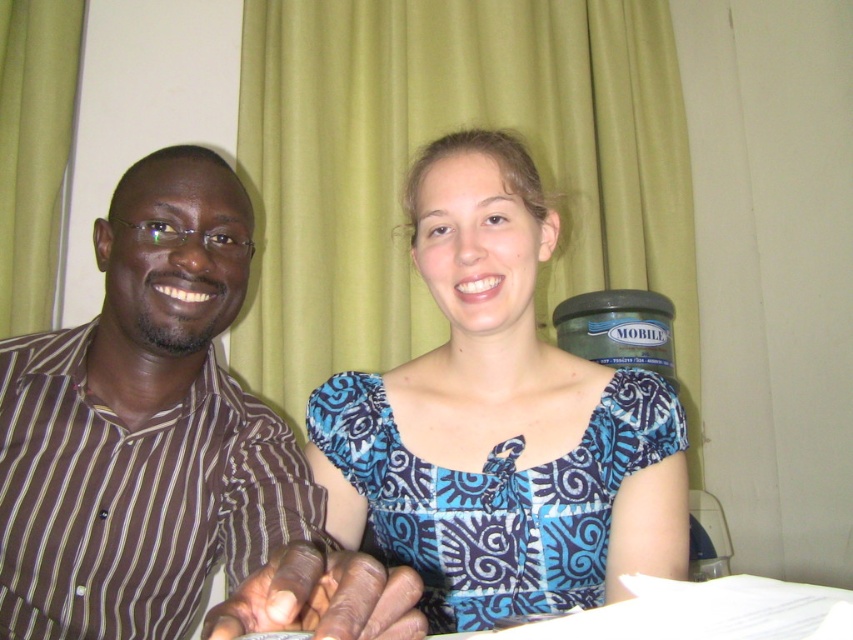
You are standing in front of the image and want to touch the brown striped shirt at left and the blue printed dress at center. Which one can you reach first without moving your hand?

The brown striped shirt at left is closer to the viewer than the blue printed dress at center, so you can reach it first without moving your hand.

You are a photographer setting up a shoot in this room. You need to position a light source so that it illuminates both the brown striped shirt at left and the blue printed dress at center without creating harsh shadows. Considering their heights, where should you place the light source relative to them?

The brown striped shirt at left is taller than the blue printed dress at center. To avoid harsh shadows, the light source should be placed above and slightly behind the taller brown striped shirt at left, ensuring both receive even illumination.